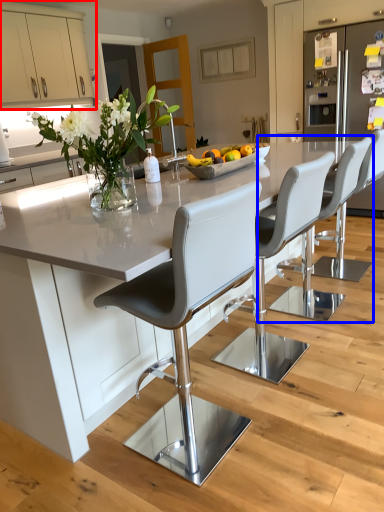
Question: Among these objects, which one is nearest to the camera, cabinetry (highlighted by a red box) or chair (highlighted by a blue box)?

Choices:
 (A) cabinetry
 (B) chair

Answer: (B)